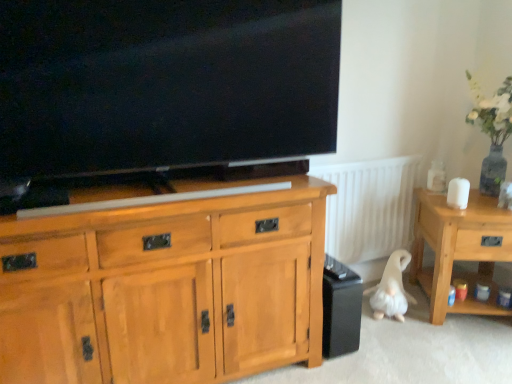
You are a GUI agent. You are given a task and a screenshot of the screen. Output one action in this format:
    pyautogui.click(x=<x>, y=<y>)
    Task: Click on the free space to the right of black matte speaker at lower right
    
    Given the screenshot: What is the action you would take?
    pyautogui.click(x=377, y=345)